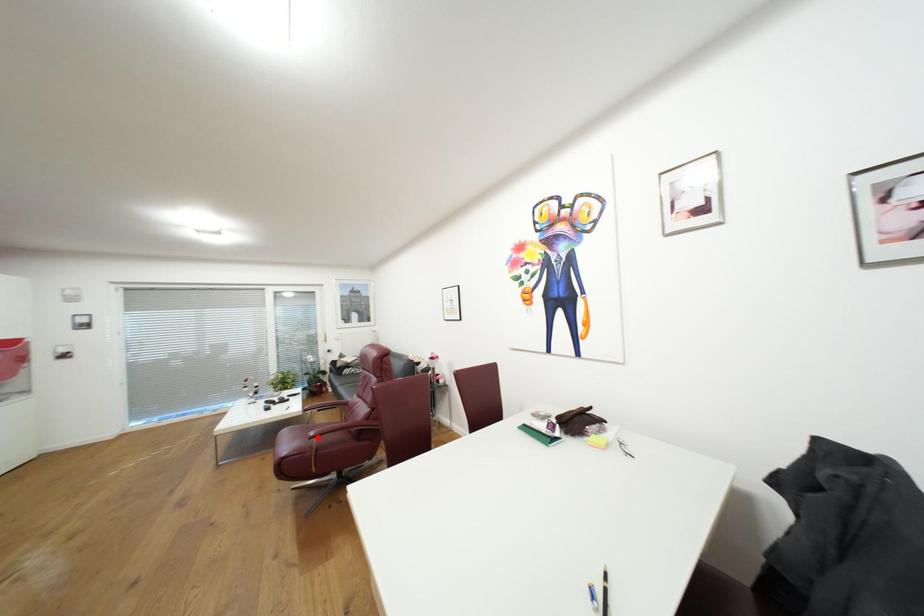
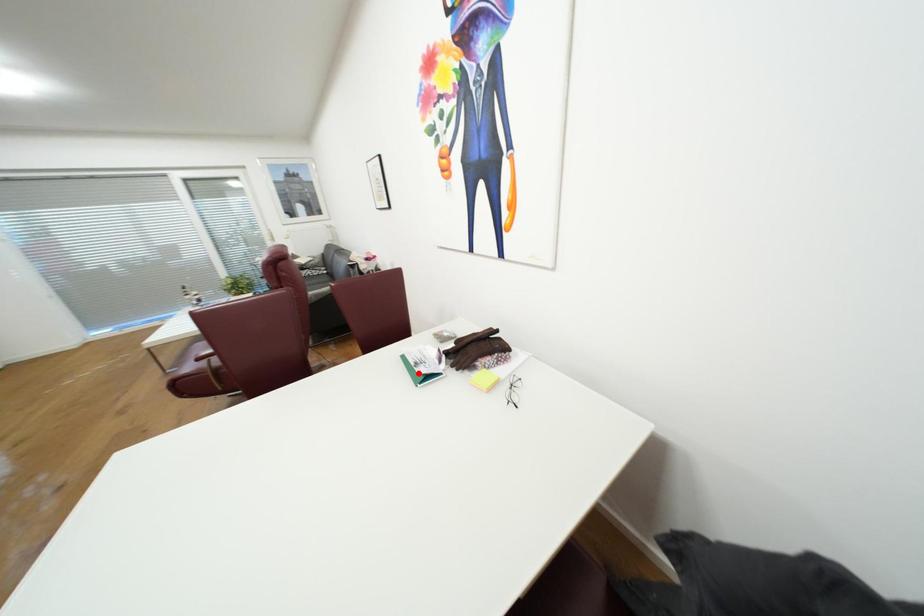
I am providing you with two images of the same scene from different viewpoints. A red point is marked on the first image and another point is marked on the second image. Do the highlighted points in image1 and image2 indicate the same real-world spot?

No